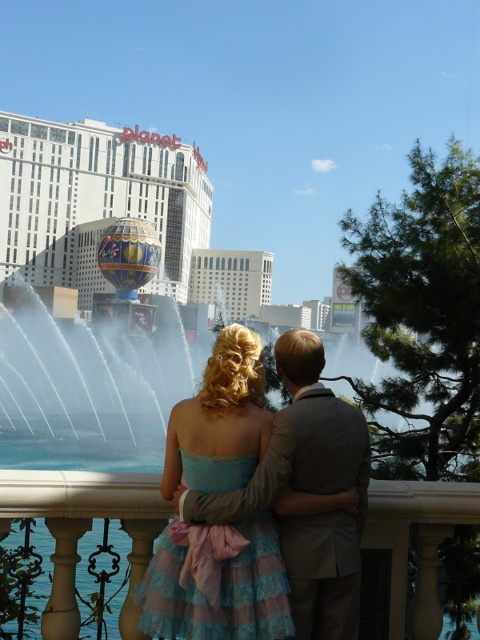
Which of these two, white glossy hotel at upper center or light brown textured suit at center, stands taller?

white glossy hotel at upper center

Consider the image. Does white glossy hotel at upper center have a lesser height compared to light brown textured suit at center?

Result: Incorrect, white glossy hotel at upper center's height does not fall short of light brown textured suit at center's.

Who is more distant from viewer, (83, 145) or (333, 412)?

The point (83, 145) is more distant.

Where is `white glossy hotel at upper center`? white glossy hotel at upper center is located at coordinates (96, 200).

Does teal satin dress at center have a larger size compared to light brown textured suit at center?

No, teal satin dress at center is not bigger than light brown textured suit at center.

Measure the distance between point (232, 449) and camera.

92.40 feet

Is point (222, 355) behind point (357, 445)?

Yes, it is.

Identify the location of teal satin dress at center. The height and width of the screenshot is (640, 480). (218, 589).

Between point (441, 490) and point (311, 413), which one is positioned behind?

Point (441, 490)

Describe the element at coordinates (83, 524) in the screenshot. This screenshot has width=480, height=640. I see `white marble balustrade at lower center` at that location.

Is point (140, 531) in front of point (278, 451)?

That is False.

Find the location of a particular element. The height and width of the screenshot is (640, 480). white marble balustrade at lower center is located at coordinates (83, 524).